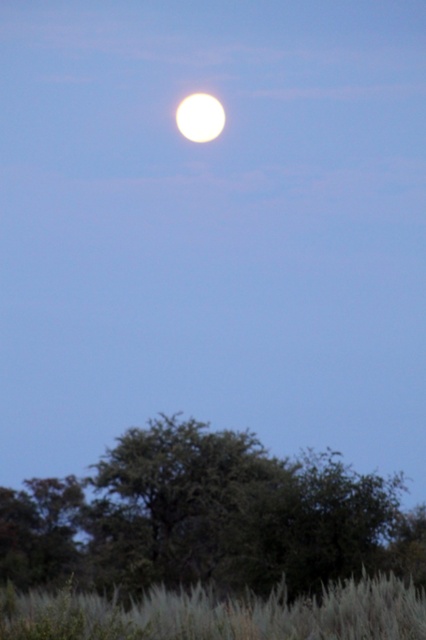
Question: Which of the following is the closest to the observer?

Choices:
 (A) bright white sphere at upper center
 (B) silvery grass at lower center

Answer: (B)

Question: Which point appears farthest from the camera in this image?

Choices:
 (A) (322, 609)
 (B) (141, 428)
 (C) (196, 131)

Answer: (C)

Question: Can you confirm if green leafy tree at lower center is smaller than silvery grass at lower center?

Choices:
 (A) yes
 (B) no

Answer: (B)

Question: Does green leafy tree at lower center have a smaller size compared to bright white sphere at upper center?

Choices:
 (A) yes
 (B) no

Answer: (B)

Question: Which point is closer to the camera taking this photo?

Choices:
 (A) (97, 524)
 (B) (210, 108)
 (C) (409, 621)

Answer: (C)

Question: Observing the image, what is the correct spatial positioning of green leafy tree at lower center in reference to bright white sphere at upper center?

Choices:
 (A) below
 (B) above

Answer: (A)